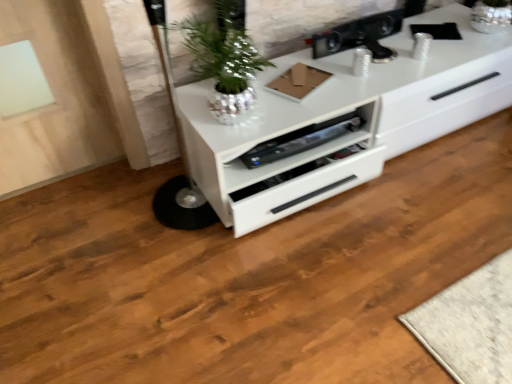
Image resolution: width=512 pixels, height=384 pixels. I want to click on free spot to the right of shiny metallic plant at center, so click(x=297, y=102).